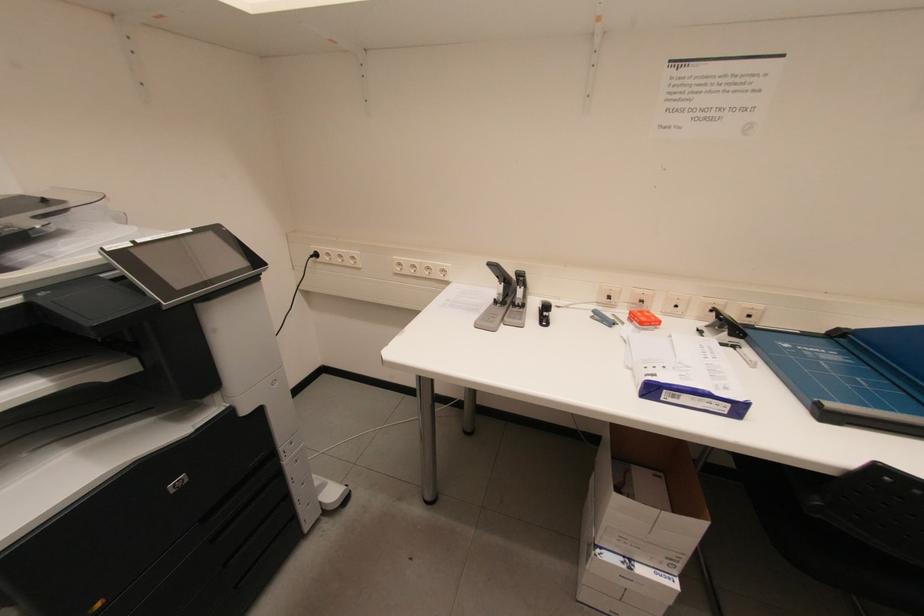
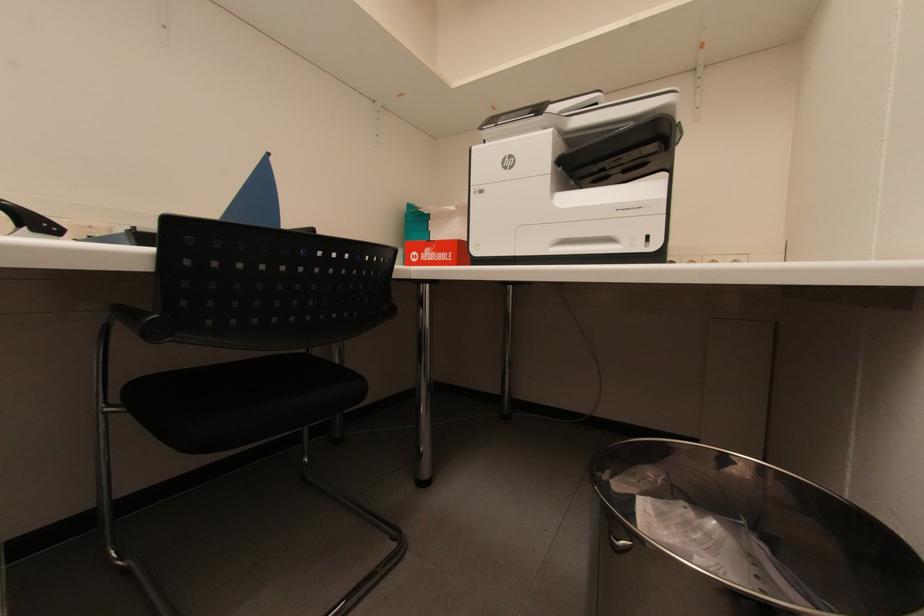
Question: Based on the continuous images, in which direction is the camera rotating? Reply with the corresponding letter.

Choices:
 (A) Left
 (B) Right
 (C) Up
 (D) Down

Answer: (B)